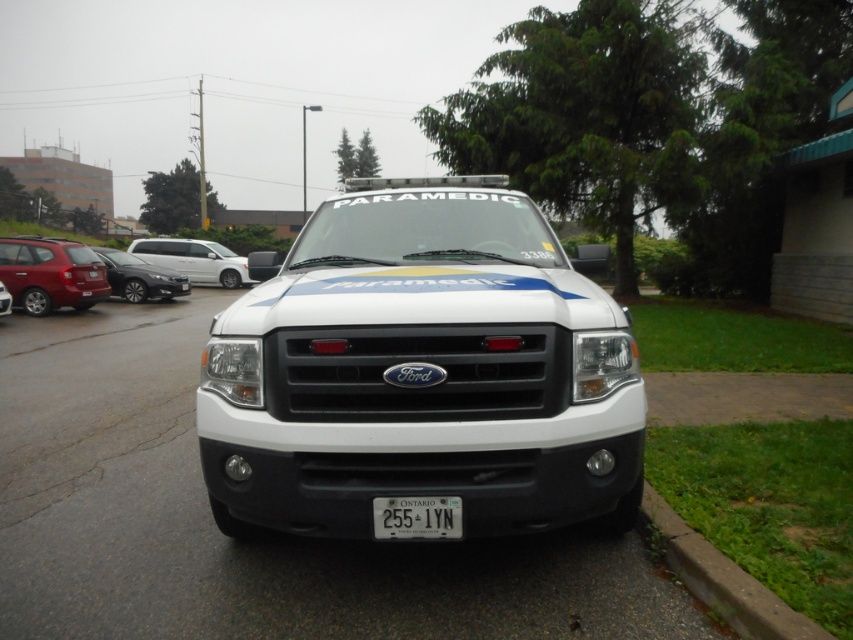
You are standing at a safe distance from the Ford paramedic vehicle. You want to approach the point marked at coordinates point (73, 282) to retrieve an item. If your maximum comfortable walking distance is 15 meters, will you be able to reach that point comfortably?

The distance of point (73, 282) from viewer is 15.89 meters, which exceeds your maximum comfortable walking distance of 15 meters. Therefore, you will not be able to reach that point comfortably.

You are a paramedic standing 9 feet away from the white plastic license plate at center. Can you reach it without moving closer?

The white plastic license plate at center is 9.17 feet away from the viewer, so you can reach it without moving closer since you are already at 9 feet distance.

Looking at this image, you are a delivery person trying to load a package onto a shelf. The shelf is 1.2 meters tall. Can the matte red suv at left and the white plastic license plate at center both fit on the shelf?

The matte red suv at left has a greater height compared to white plastic license plate at center. Since the shelf is 1.2 meters tall, the matte red suv at left may not fit if its height exceeds 1.2 meters, but the white plastic license plate at center might fit if its height is under 1.2 meters. However, without exact measurements, it is uncertain.